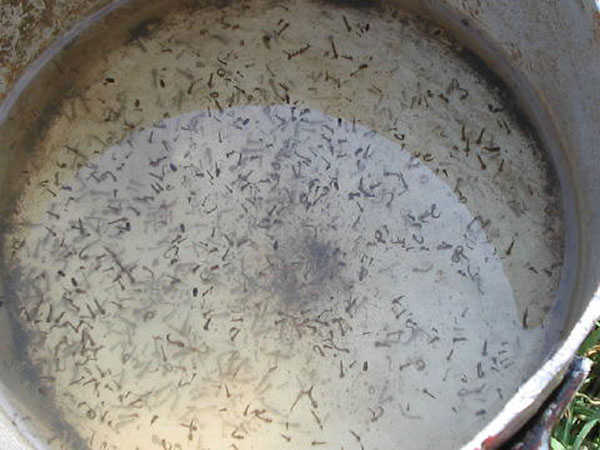
Locate an element on the screen. rim of pan is located at coordinates (529, 396), (6, 437).